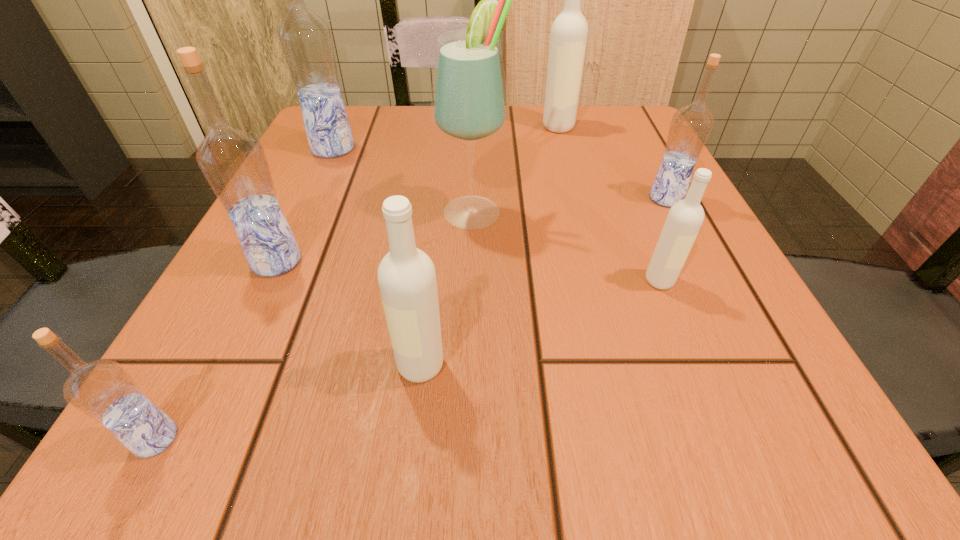
Find the location of `vacant area at the near left corner of the desktop`. vacant area at the near left corner of the desktop is located at coordinates (122, 456).

Locate an element on the screen. This screenshot has width=960, height=540. vacant space at the far right corner of the desktop is located at coordinates [x=634, y=122].

Identify the location of vacant area between the biggest white vodka and the alcohol. (516, 168).

You are a GUI agent. You are given a task and a screenshot of the screen. Output one action in this format:
    pyautogui.click(x=<x>, y=<y>)
    Task: Click on the vacant area that lies between the rightmost blue vodka and the biggest blue vodka
    The image size is (960, 540).
    Given the screenshot: What is the action you would take?
    pyautogui.click(x=499, y=173)

You are a GUI agent. You are given a task and a screenshot of the screen. Output one action in this format:
    pyautogui.click(x=<x>, y=<y>)
    Task: Click on the free spot between the fifth vodka from left to right and the third nearest blue vodka
    
    Given the screenshot: What is the action you would take?
    pyautogui.click(x=612, y=163)

Locate an element on the screen. free spot between the fourth vodka from left to right and the alcohol is located at coordinates (447, 288).

Identify the location of free space between the leftmost white vodka and the rightmost blue vodka. (543, 282).

This screenshot has width=960, height=540. Find the location of `vacant area that lies between the second farthest blue vodka and the alcohol`. vacant area that lies between the second farthest blue vodka and the alcohol is located at coordinates (569, 204).

This screenshot has height=540, width=960. Find the location of `free point between the second nearest blue vodka and the seventh object from left to right`. free point between the second nearest blue vodka and the seventh object from left to right is located at coordinates (468, 271).

The image size is (960, 540). Find the location of `vacant space that's between the alcohol and the leftmost white vodka`. vacant space that's between the alcohol and the leftmost white vodka is located at coordinates [447, 288].